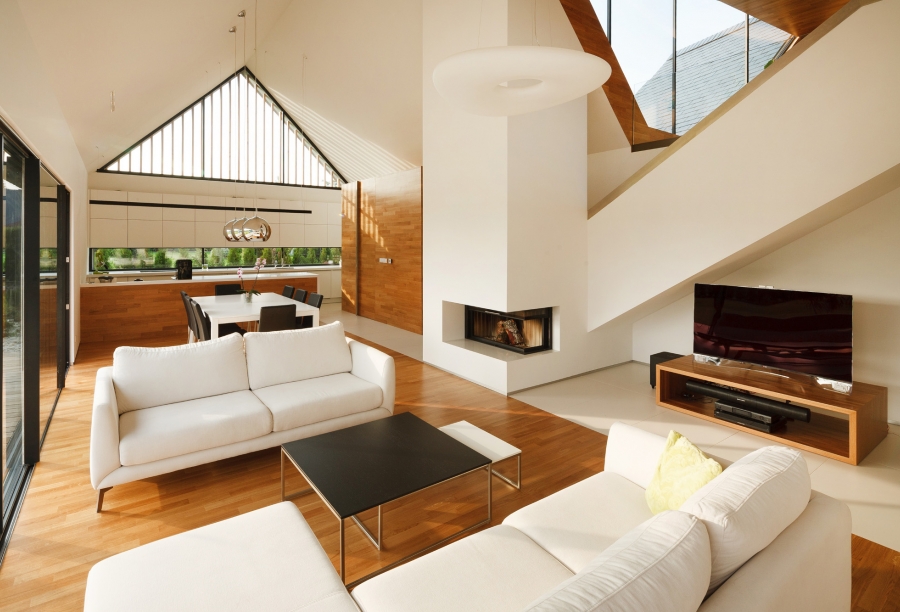
Locate an element on the screen. The height and width of the screenshot is (612, 900). plant is located at coordinates (244, 296).